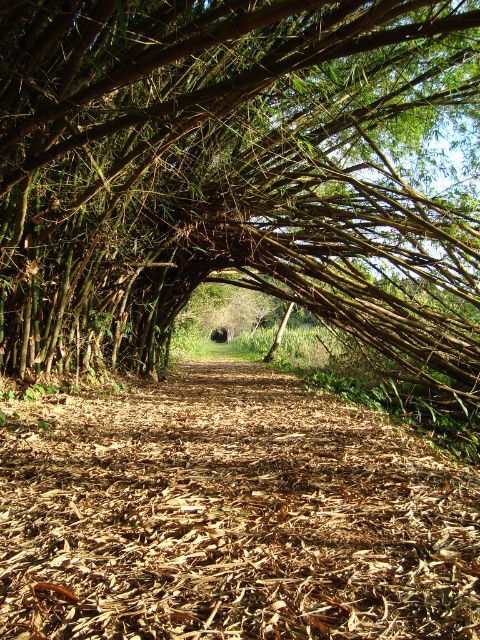
You are a hiker walking along the brown mulch trail at center and notice the green leafy tree at center nearby. Which one is wider in terms of their spread?

The green leafy tree at center has a larger width than the brown mulch trail at center, so the tree is wider.

You are a hiker walking along the brown mulch trail at center and notice the green leafy tree at center ahead. Which one is closer to you as you walk forward?

The green leafy tree at center is in front of the brown mulch trail at center, so it is closer to you as you walk forward.